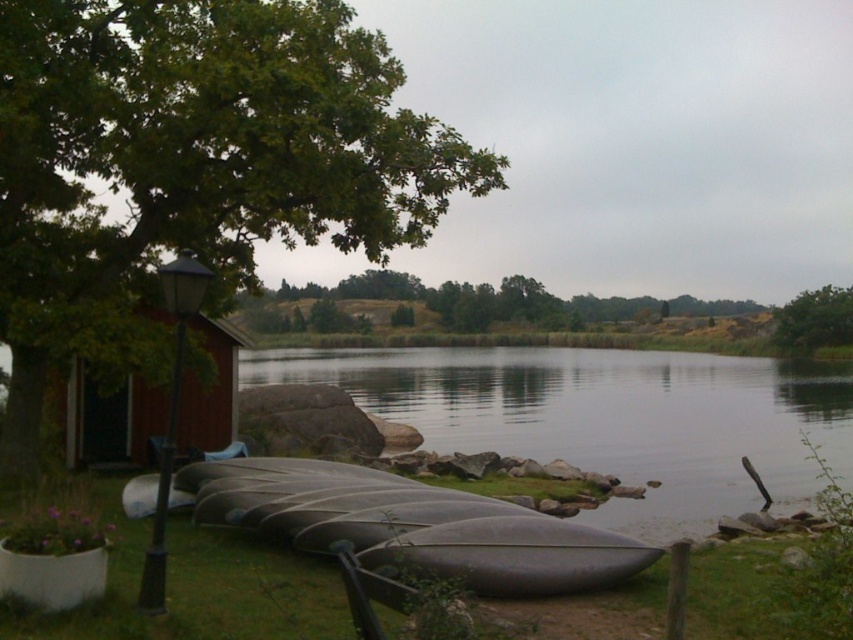
Consider the image. You are a visitor at the lakeside and need to find the boathouse. You see the matte black canoe at lower center and the brown wooden hut at left. Which object is closer to the water?

The matte black canoe at lower center is positioned on the right side of the brown wooden hut at left, so the canoe is closer to the water than the brown wooden hut at left.

You are standing at the point with coordinates point (828, 320) and want to move towards the point with coordinates point (552, 561). Which direction should you face to walk towards it?

You should face towards the direction of the point (552, 561), which is in front of point (828, 320), so you need to walk forward to reach it.